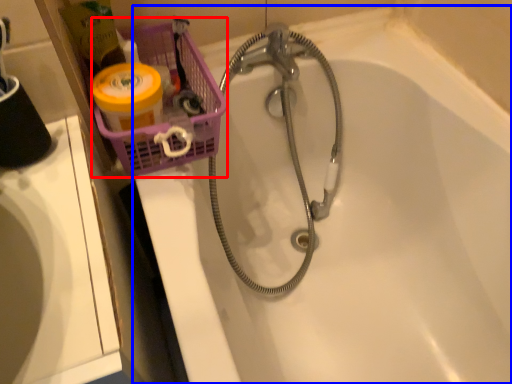
Question: Among these objects, which one is nearest to the camera, basket (highlighted by a red box) or bathtub (highlighted by a blue box)?

Choices:
 (A) basket
 (B) bathtub

Answer: (B)